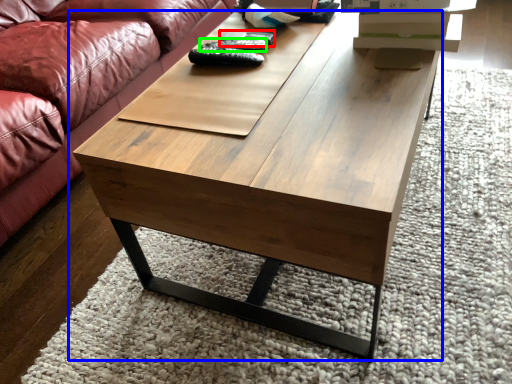
Question: Which object is the closest to the remote (highlighted by a red box)? Choose among these: coffee table (highlighted by a blue box) or remote (highlighted by a green box).

Choices:
 (A) coffee table
 (B) remote

Answer: (B)